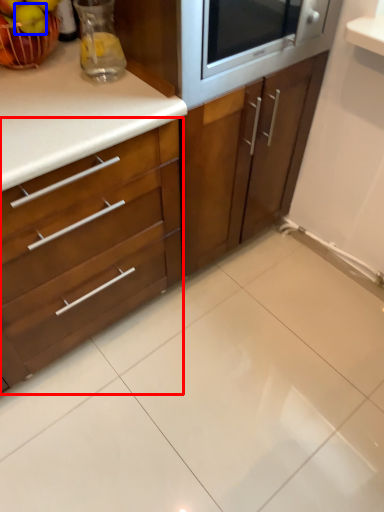
Question: Which point is further to the camera, cabinetry (highlighted by a red box) or apple (highlighted by a blue box)?

Choices:
 (A) cabinetry
 (B) apple

Answer: (B)